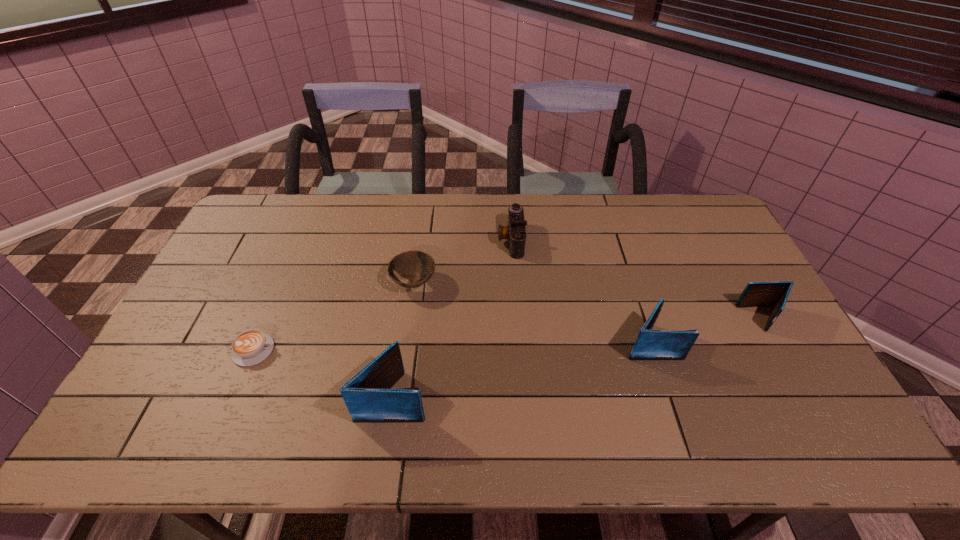
Please determine a free point for an extra wallet to ensure balance. Please provide its 2D coordinates. Your answer should be formatted as a tuple, i.e. [(x, y)], where the tuple contains the x and y coordinates of a point satisfying the conditions above.

[(528, 368)]